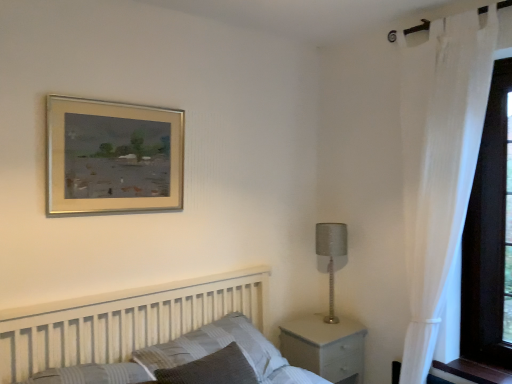
Where is `vacant area on the back side of satin silver lamp at right`? vacant area on the back side of satin silver lamp at right is located at coordinates (x=321, y=320).